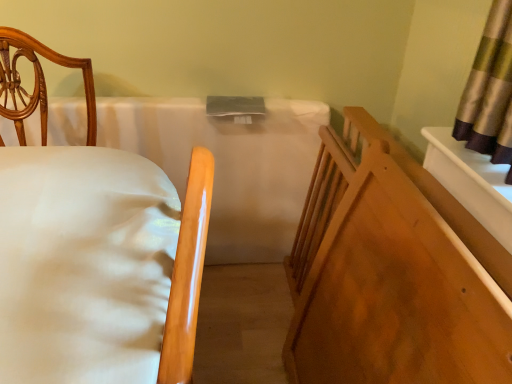
Question: Can you confirm if smooth wood crib at right is smaller than white smooth mattress at center?

Choices:
 (A) no
 (B) yes

Answer: (B)

Question: Considering the relative sizes of smooth wood crib at right and white smooth mattress at center in the image provided, is smooth wood crib at right taller than white smooth mattress at center?

Choices:
 (A) no
 (B) yes

Answer: (A)

Question: From the image's perspective, is smooth wood crib at right located above white smooth mattress at center?

Choices:
 (A) yes
 (B) no

Answer: (B)

Question: Could you tell me if smooth wood crib at right is turned towards white smooth mattress at center?

Choices:
 (A) yes
 (B) no

Answer: (B)

Question: Is smooth wood crib at right beside white smooth mattress at center?

Choices:
 (A) no
 (B) yes

Answer: (A)

Question: Is white smooth mattress at center wider or thinner than smooth wood crib at right?

Choices:
 (A) thin
 (B) wide

Answer: (A)

Question: Is point pyautogui.click(x=226, y=253) positioned closer to the camera than point pyautogui.click(x=468, y=349)?

Choices:
 (A) closer
 (B) farther

Answer: (B)

Question: Based on their positions, is white smooth mattress at center located to the left or right of smooth wood crib at right?

Choices:
 (A) left
 (B) right

Answer: (A)

Question: In the image, is white smooth mattress at center positioned in front of or behind smooth wood crib at right?

Choices:
 (A) behind
 (B) front

Answer: (A)

Question: Based on their positions, is white fabric bed at left located to the left or right of smooth wood crib at right?

Choices:
 (A) right
 (B) left

Answer: (B)

Question: In the image, is white fabric bed at left positioned in front of or behind smooth wood crib at right?

Choices:
 (A) front
 (B) behind

Answer: (A)

Question: In terms of size, does white fabric bed at left appear bigger or smaller than smooth wood crib at right?

Choices:
 (A) small
 (B) big

Answer: (B)

Question: Considering the positions of white fabric bed at left and smooth wood crib at right in the image, is white fabric bed at left wider or thinner than smooth wood crib at right?

Choices:
 (A) wide
 (B) thin

Answer: (A)

Question: Based on their positions, is white smooth mattress at center located to the left or right of white fabric bed at left?

Choices:
 (A) left
 (B) right

Answer: (A)

Question: In terms of width, does white smooth mattress at center look wider or thinner when compared to white fabric bed at left?

Choices:
 (A) wide
 (B) thin

Answer: (B)